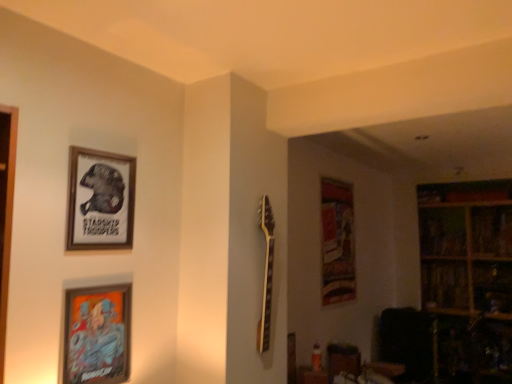
Question: From a real-world perspective, is metallic silver picture frame at lower left, positioned as the 2th picture frame in top-to-bottom order, positioned above or below wooden bookshelf at right, the second shelf from the top?

Choices:
 (A) above
 (B) below

Answer: (A)

Question: Relative to wooden bookshelf at right, the first shelf in the bottom-to-top sequence, is metallic silver picture frame at lower left, positioned as the 1th picture frame in bottom-to-top order, in front or behind?

Choices:
 (A) behind
 (B) front

Answer: (B)

Question: Which of these objects is positioned closest to the wooden bookshelf at right, the second shelf from the top?

Choices:
 (A) wooden framed poster at upper left, which ranks as the first picture frame in top-to-bottom order
 (B) wooden bookshelf at upper right, the 2th shelf in the bottom-to-top sequence
 (C) metallic silver picture frame at lower left, positioned as the 1th picture frame in bottom-to-top order

Answer: (B)

Question: Estimate the real-world distances between objects in this image. Which object is closer to the wooden bookshelf at upper right, the 2th shelf in the bottom-to-top sequence?

Choices:
 (A) metallic silver picture frame at lower left, positioned as the 1th picture frame in bottom-to-top order
 (B) wooden bookshelf at right, the first shelf in the bottom-to-top sequence
 (C) wooden framed poster at upper left, which is the 2th picture frame from bottom to top

Answer: (B)